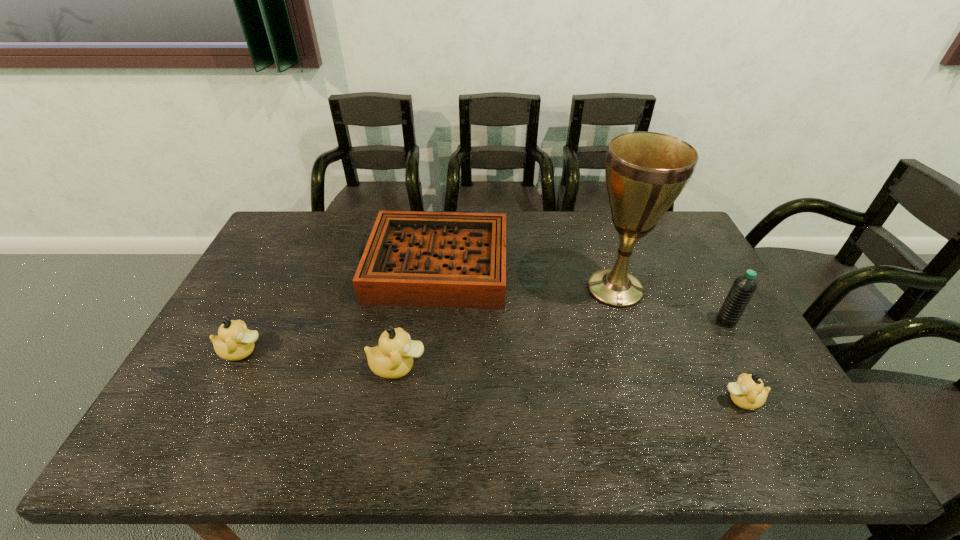
Find the location of a particular element. the second tallest duckling is located at coordinates (234, 342).

Locate an element on the screen. The height and width of the screenshot is (540, 960). the leftmost object is located at coordinates (234, 342).

Where is `the tallest duckling`? The image size is (960, 540). the tallest duckling is located at coordinates (393, 358).

Where is `the fourth shortest object`? The height and width of the screenshot is (540, 960). the fourth shortest object is located at coordinates (393, 358).

Where is `the nearest duckling`? The width and height of the screenshot is (960, 540). the nearest duckling is located at coordinates (748, 392).

In order to click on the shortest duckling in this screenshot , I will do `click(748, 392)`.

Locate an element on the screen. water bottle is located at coordinates (743, 288).

Find the location of a particular element. the fifth shortest object is located at coordinates (743, 288).

Locate an element on the screen. gameboard is located at coordinates click(419, 259).

Where is `the third object from right to left`? The width and height of the screenshot is (960, 540). the third object from right to left is located at coordinates click(645, 172).